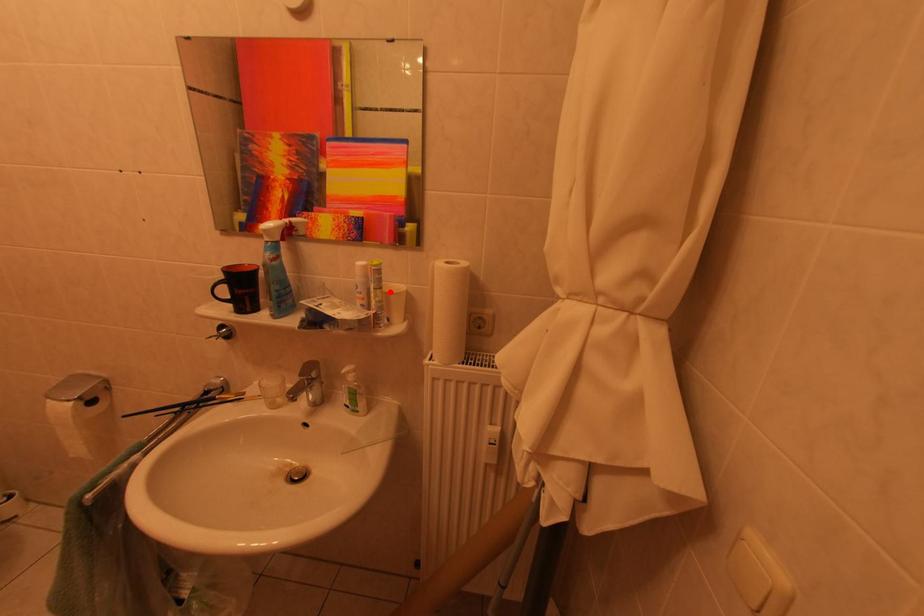
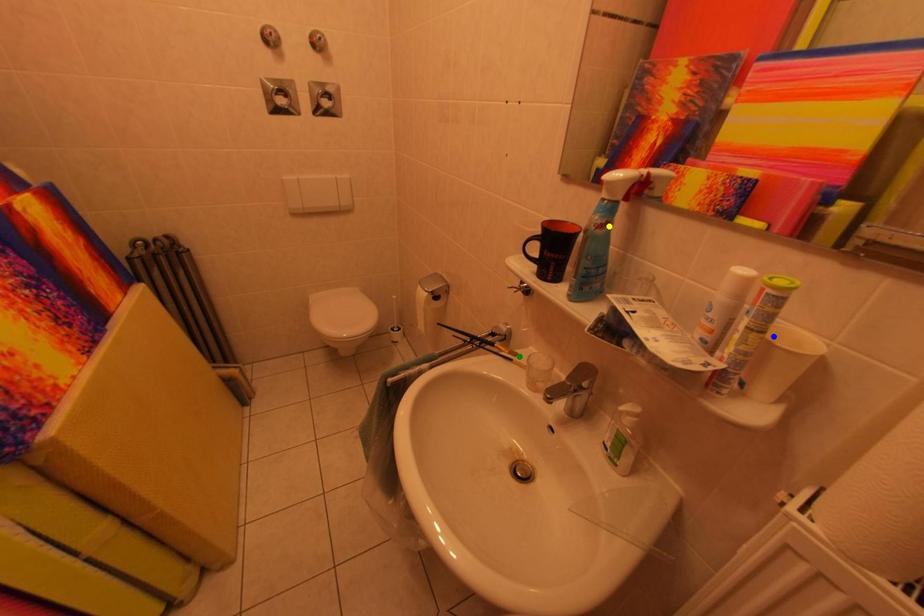
Question: I am providing you with two images of the same scene from different viewpoints. A red point is marked on the first image. You are given multiple points on the second image. Which point in image 2 is actually the same real-world point as the red point in image 1?

Choices:
 (A) green point
 (B) blue point
 (C) yellow point

Answer: (B)